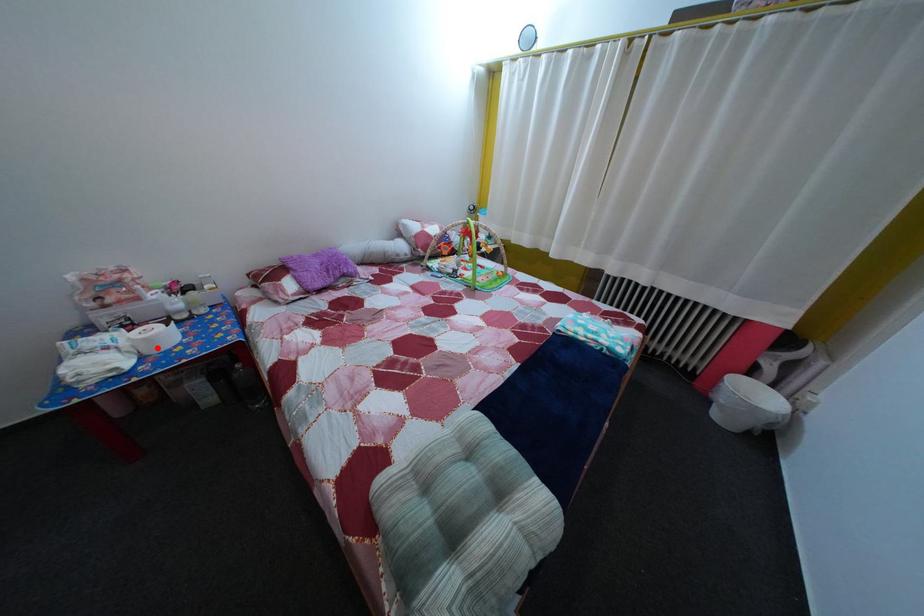
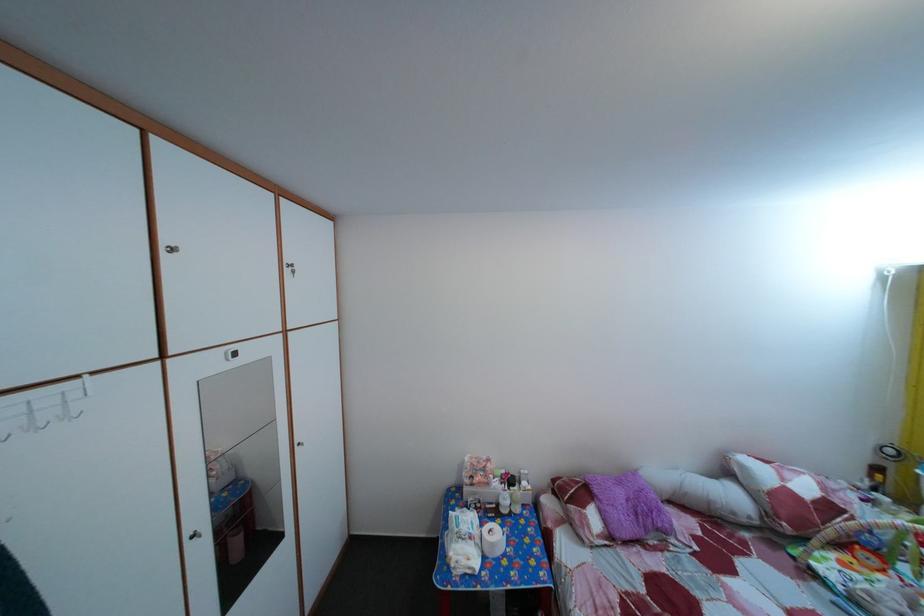
Question: I am providing you with two images of the same scene from different viewpoints. Given a red point in image1, look at the same physical point in image2. Is it:

Choices:
 (A) Closer to the viewpoint
 (B) Farther from the viewpoint

Answer: (A)